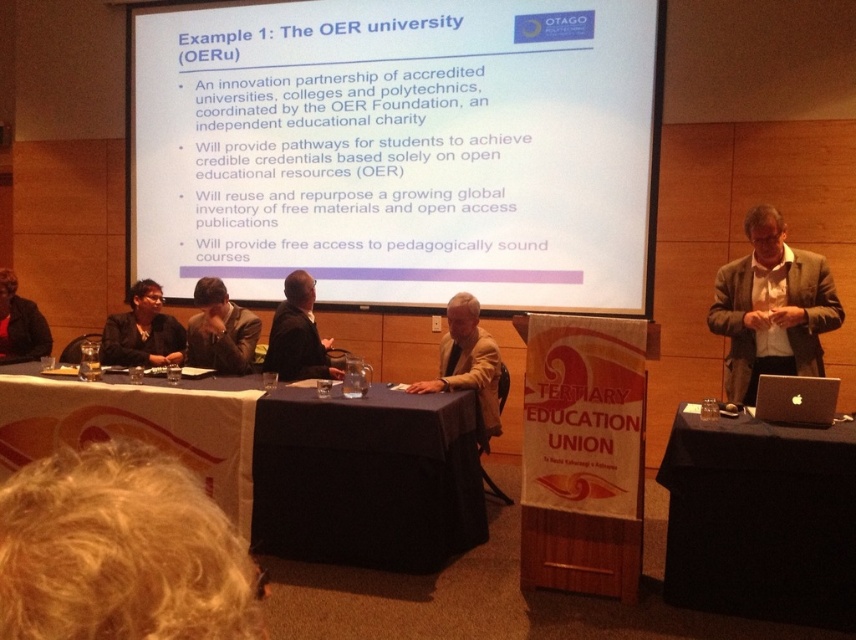
Is white matte projector screen at upper center smaller than dark brown leather jacket at left?

No.

Is white matte projector screen at upper center above dark brown leather jacket at left?

Yes, white matte projector screen at upper center is above dark brown leather jacket at left.

Which is behind, point (215, 172) or point (24, 305)?

Point (215, 172)

Find the location of `white matte projector screen at upper center`. white matte projector screen at upper center is located at coordinates (397, 148).

Which of these two, light beige suit at center or silver metallic laptop at right, stands shorter?

Standing shorter between the two is silver metallic laptop at right.

Who is lower down, light beige suit at center or silver metallic laptop at right?

silver metallic laptop at right

Does point (498, 353) lie behind point (792, 420)?

Yes, point (498, 353) is farther from viewer.

This screenshot has height=640, width=856. What are the coordinates of `light beige suit at center` in the screenshot? It's located at (467, 362).

Does point (810, 300) come closer to viewer compared to point (9, 352)?

That is True.

What do you see at coordinates (771, 307) in the screenshot?
I see `brown textured suit at right` at bounding box center [771, 307].

Find the location of a particular element. brown textured suit at right is located at coordinates (771, 307).